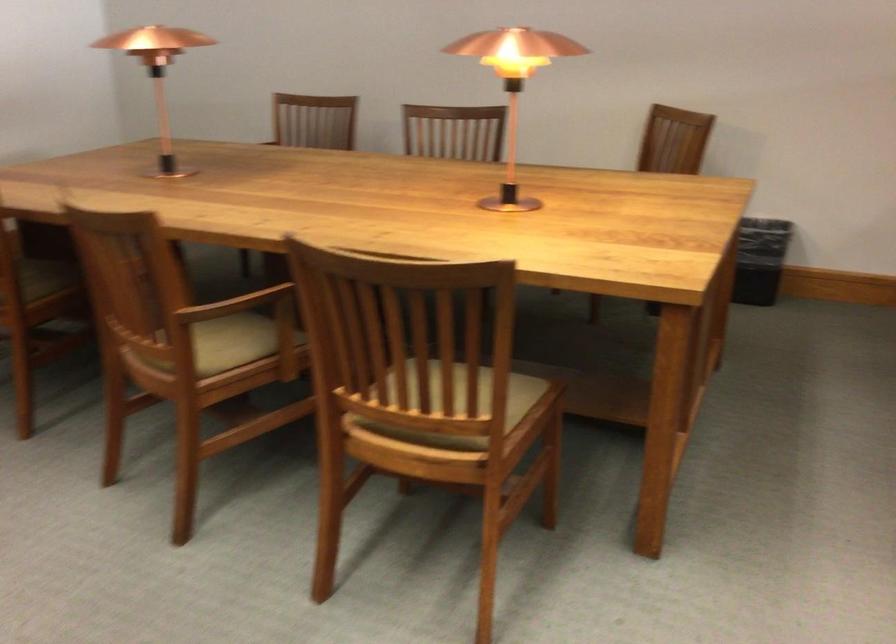
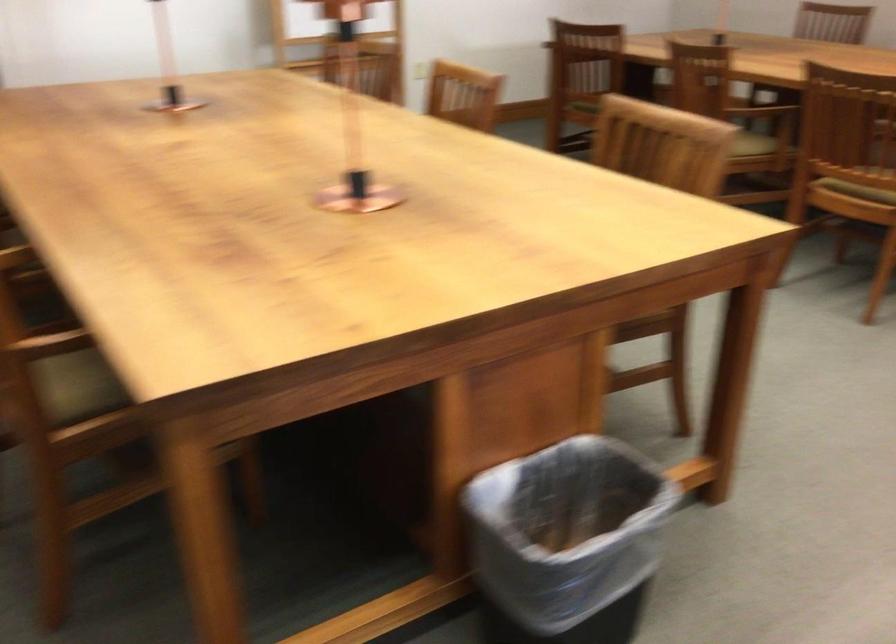
Question: I am providing you with two images of the same scene from different viewpoints. Please identify which objects are invisible in image2.

Choices:
 (A) wooden chair sitting surface
 (B) green chair sitting surface
 (C) light blue ottoman
 (D) light brown chair sitting surface

Answer: (D)